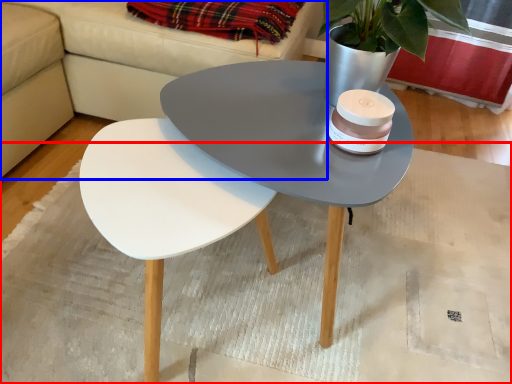
Question: Which object is closer to the camera taking this photo, mat (highlighted by a red box) or couch (highlighted by a blue box)?

Choices:
 (A) mat
 (B) couch

Answer: (A)